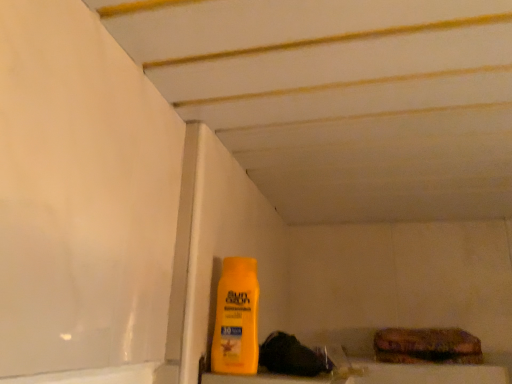
You are a GUI agent. You are given a task and a screenshot of the screen. Output one action in this format:
    pyautogui.click(x=<x>, y=<y>)
    Task: Click on the yellow matte bottle at center
    This screenshot has height=384, width=512.
    Given the screenshot: What is the action you would take?
    pyautogui.click(x=236, y=318)

What do you see at coordinates (236, 318) in the screenshot?
I see `yellow matte bottle at center` at bounding box center [236, 318].

What do you see at coordinates (426, 346) in the screenshot? I see `textured brown bread at lower right` at bounding box center [426, 346].

In order to face textured brown bread at lower right, should I rotate leftwards or rightwards?

Rotate your view right by about 22.238°.

Measure the distance between textured brown bread at lower right and camera.

textured brown bread at lower right is 38.76 inches away from camera.

The image size is (512, 384). Identify the location of textured brown bread at lower right. (426, 346).

Image resolution: width=512 pixels, height=384 pixels. I want to click on yellow matte bottle at center, so click(236, 318).

Can you confirm if yellow matte bottle at center is positioned to the right of textured brown bread at lower right?

No, yellow matte bottle at center is not to the right of textured brown bread at lower right.

Is yellow matte bottle at center closer to the viewer compared to textured brown bread at lower right?

Yes, yellow matte bottle at center is closer to the camera.

Which is less distant, [240,358] or [449,356]?

Point [240,358] is closer to the camera than point [449,356].

From the image's perspective, is yellow matte bottle at center positioned above or below textured brown bread at lower right?

Based on their image positions, yellow matte bottle at center is located above textured brown bread at lower right.

From a real-world perspective, is yellow matte bottle at center located beneath textured brown bread at lower right?

Incorrect, from a real-world perspective, yellow matte bottle at center is higher than textured brown bread at lower right.

In the scene shown: Considering the sizes of objects yellow matte bottle at center and textured brown bread at lower right in the image provided, who is wider, yellow matte bottle at center or textured brown bread at lower right?

textured brown bread at lower right is wider.

Which of these two, yellow matte bottle at center or textured brown bread at lower right, stands taller?

With more height is yellow matte bottle at center.

Consider the image. Who is bigger, yellow matte bottle at center or textured brown bread at lower right?

textured brown bread at lower right.

Can we say yellow matte bottle at center lies outside textured brown bread at lower right?

yellow matte bottle at center lies outside textured brown bread at lower right's area.

Is yellow matte bottle at center not close to textured brown bread at lower right?

No, yellow matte bottle at center is in close proximity to textured brown bread at lower right.

Is yellow matte bottle at center turned away from textured brown bread at lower right?

No.

How different are the orientations of yellow matte bottle at center and textured brown bread at lower right in degrees?

There is a 89.6-degree angle between the facing directions of yellow matte bottle at center and textured brown bread at lower right.

The height and width of the screenshot is (384, 512). I want to click on bottle that is on the left side of textured brown bread at lower right, so click(x=236, y=318).

Considering the relative positions of textured brown bread at lower right and yellow matte bottle at center in the image provided, is textured brown bread at lower right to the left or to the right of yellow matte bottle at center?

textured brown bread at lower right is positioned on yellow matte bottle at center's right side.

Is textured brown bread at lower right in front of yellow matte bottle at center?

No, textured brown bread at lower right is further to the viewer.

Which is closer, (377, 350) or (230, 341)?

Point (377, 350).

From the image's perspective, who appears lower, textured brown bread at lower right or yellow matte bottle at center?

From the image's view, textured brown bread at lower right is below.

From a real-world perspective, which is physically below, textured brown bread at lower right or yellow matte bottle at center?

From a 3D spatial view, textured brown bread at lower right is below.

Can you confirm if textured brown bread at lower right is thinner than yellow matte bottle at center?

No.

Which of these two, textured brown bread at lower right or yellow matte bottle at center, stands taller?

Standing taller between the two is yellow matte bottle at center.

Can you confirm if textured brown bread at lower right is smaller than yellow matte bottle at center?

No.

Is textured brown bread at lower right located outside yellow matte bottle at center?

Yes.

Is there a large distance between textured brown bread at lower right and yellow matte bottle at center?

Actually, textured brown bread at lower right and yellow matte bottle at center are a little close together.

Is textured brown bread at lower right looking in the opposite direction of yellow matte bottle at center?

No.

How many degrees apart are the facing directions of textured brown bread at lower right and yellow matte bottle at center?

They differ by 89.6 degrees in their facing directions.

How distant is textured brown bread at lower right from yellow matte bottle at center?

textured brown bread at lower right is 21.92 inches away from yellow matte bottle at center.

The image size is (512, 384). There is a textured brown bread at lower right. In order to click on bottle above it (from a real-world perspective) in this screenshot , I will do `click(236, 318)`.

Where is `bottle that is on the left side of textured brown bread at lower right`? The height and width of the screenshot is (384, 512). bottle that is on the left side of textured brown bread at lower right is located at coordinates (236, 318).

Identify the location of food below the yellow matte bottle at center (from the image's perspective). The image size is (512, 384). (426, 346).